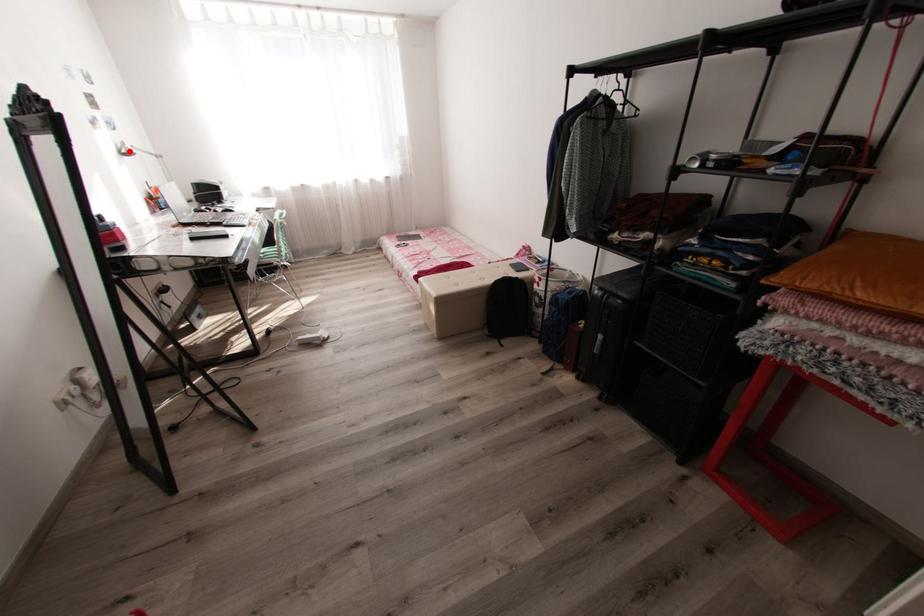
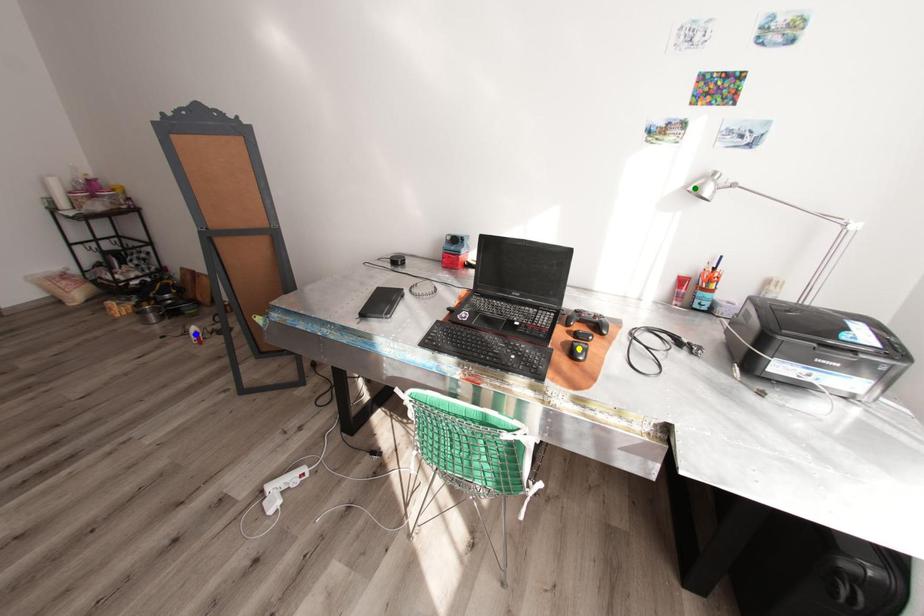
Question: I am providing you with two images of the same scene from different viewpoints. A red point is marked on the first image. You are given multiple points on the second image. Which mark in image 2 goes with the point in image 1?

Choices:
 (A) yellow point
 (B) blue point
 (C) green point

Answer: (C)